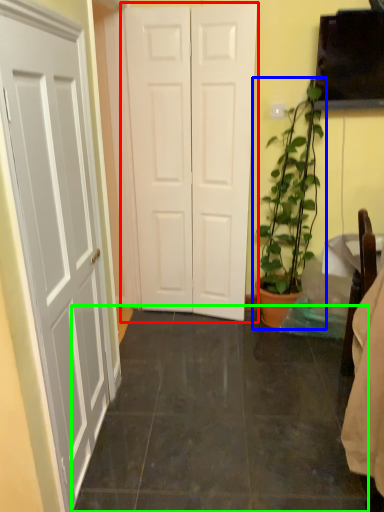
Question: Which object is the closest to the door (highlighted by a red box)? Choose among these: houseplant (highlighted by a blue box) or tile (highlighted by a green box).

Choices:
 (A) houseplant
 (B) tile

Answer: (A)